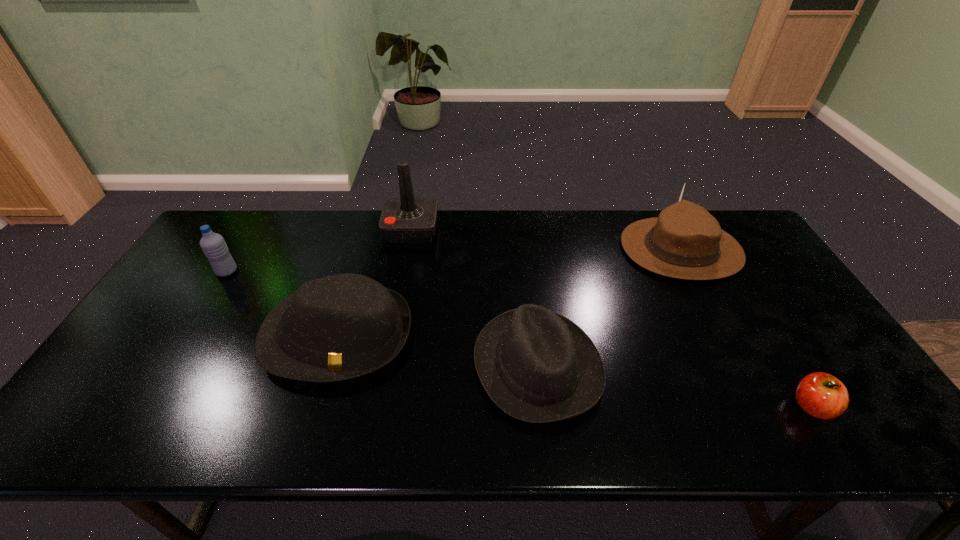
I want to click on vacant point located on the feather side of the rightmost fedora, so click(502, 249).

The height and width of the screenshot is (540, 960). Identify the location of free space located on the back of the water bottle. (241, 248).

Image resolution: width=960 pixels, height=540 pixels. I want to click on free space located 0.080m on the front-facing side of the leftmost fedora, so click(312, 421).

The width and height of the screenshot is (960, 540). Identify the location of vacant position located on the left of the second shortest object. (438, 366).

At what (x,y) coordinates should I click in order to perform the action: click on vacant area located on the left of the shortest object. Please return your answer as a coordinate pair (x, y). Image resolution: width=960 pixels, height=540 pixels. Looking at the image, I should click on (618, 406).

Identify the location of joystick at the far edge. (406, 219).

Locate an element on the screen. This screenshot has width=960, height=540. fedora that is positioned at the far edge is located at coordinates (686, 242).

This screenshot has height=540, width=960. I want to click on fedora situated at the near edge, so click(536, 365).

At what (x,y) coordinates should I click in order to perform the action: click on apple situated at the near edge. Please return your answer as a coordinate pair (x, y). Image resolution: width=960 pixels, height=540 pixels. Looking at the image, I should click on (821, 395).

Identify the location of object that is at the left edge. The height and width of the screenshot is (540, 960). (213, 245).